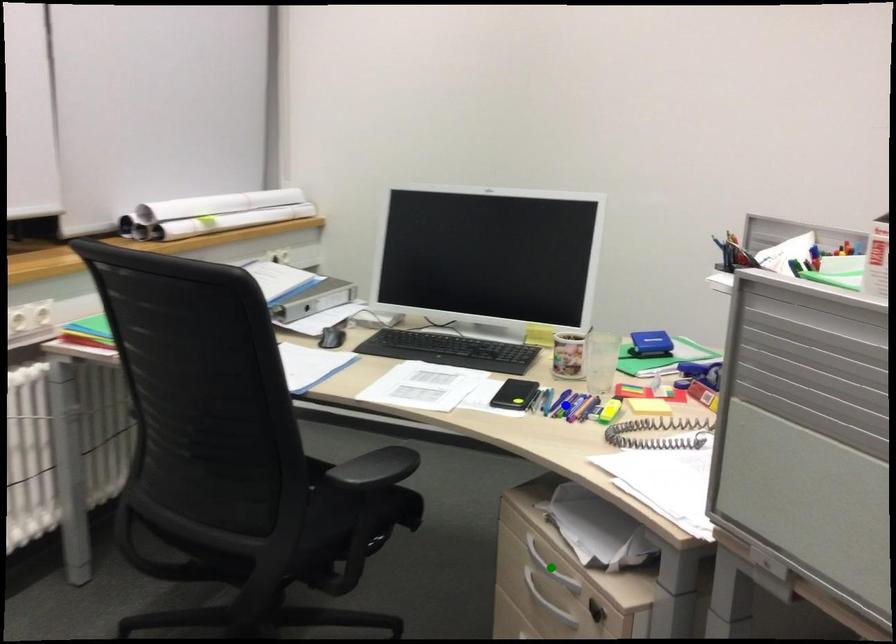
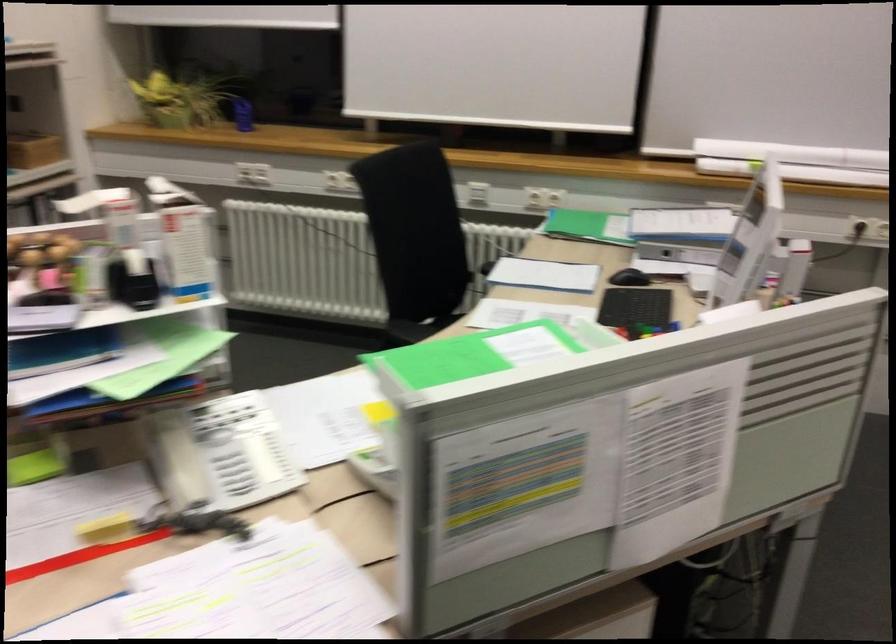
I am providing you with two images of the same scene from different viewpoints. Three points are marked in image1. Which point corresponds to a part or object that is occluded in image2?In image1, three points are marked. Which of them correspond to a part or object that is occluded in image2?Among the three points shown in image1, which one corresponds to a part or object that is no longer visible due to occlusion in image2?

yellow point, green point, blue point cannot be seen in image2.